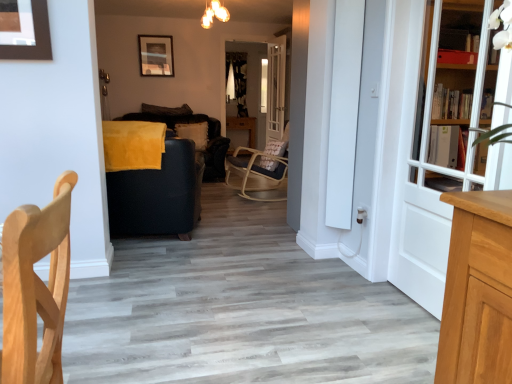
Where is `white glass door at center, the 1th door in the top-to-bottom sequence`? The width and height of the screenshot is (512, 384). white glass door at center, the 1th door in the top-to-bottom sequence is located at coordinates (275, 89).

In order to face white glass door at center, which is the 2th door from right to left, should I rotate leftwards or rightwards?

Rotate right and turn 2.544 degrees.

Where is `beige textured pillow at center, the second pillow viewed from the top`? This screenshot has width=512, height=384. beige textured pillow at center, the second pillow viewed from the top is located at coordinates (194, 133).

How much space does velvet black armchair at center, which is the 1th chair in back-to-front order, occupy horizontally?

velvet black armchair at center, which is the 1th chair in back-to-front order, is 39.11 inches in width.

This screenshot has width=512, height=384. What do you see at coordinates (214, 14) in the screenshot? I see `warm glass chandelier at upper center` at bounding box center [214, 14].

From the picture: In order to face white wooden bookcase at right, should I rotate leftwards or rightwards?

Rotate right and turn 32.406 degrees.

Where is `white glass door at center, the 1th door in the top-to-bottom sequence`? The image size is (512, 384). white glass door at center, the 1th door in the top-to-bottom sequence is located at coordinates (275, 89).

Which point is more forward, (x=152, y=112) or (x=146, y=72)?

The point (x=146, y=72) is closer.

Locate an element on the screen. the 1st pillow counting from the right side of the matte black picture frame at upper center is located at coordinates (166, 110).

How far apart are suede-like brown pillow at center, which is counted as the 2th pillow, starting from the bottom, and matte black picture frame at upper center?

26.83 inches.

Can you see suede-like brown pillow at center, which is counted as the 2th pillow, starting from the bottom, touching matte black picture frame at upper center?

No, suede-like brown pillow at center, which is counted as the 2th pillow, starting from the bottom, is not in contact with matte black picture frame at upper center.

Is warm glass chandelier at upper center not near white wooden bookcase at right?

Yes, warm glass chandelier at upper center and white wooden bookcase at right are quite far apart.

From the picture: In the image, is warm glass chandelier at upper center positioned in front of or behind white wooden bookcase at right?

Visually, warm glass chandelier at upper center is located behind white wooden bookcase at right.

Which is more to the right, warm glass chandelier at upper center or white wooden bookcase at right?

white wooden bookcase at right is more to the right.

Does white glass door at center, which ranks as the second door in bottom-to-top order, have a greater width compared to beige textured pillow at center, the second pillow viewed from the top?

In fact, white glass door at center, which ranks as the second door in bottom-to-top order, might be narrower than beige textured pillow at center, the second pillow viewed from the top.

Which of these two, white glass door at center, placed as the second door when sorted from front to back, or beige textured pillow at center, the first pillow ordered from the bottom, is bigger?

white glass door at center, placed as the second door when sorted from front to back.

What's the angular difference between white glass door at center, the 1th door in the top-to-bottom sequence, and beige textured pillow at center, the first pillow ordered from the bottom,'s facing directions?

The angle between the facing direction of white glass door at center, the 1th door in the top-to-bottom sequence, and the facing direction of beige textured pillow at center, the first pillow ordered from the bottom, is 84.9 degrees.

Is white glass door at center, placed as the second door when sorted from front to back, to the left of beige textured pillow at center, the second pillow viewed from the top, from the viewer's perspective?

Incorrect, white glass door at center, placed as the second door when sorted from front to back, is not on the left side of beige textured pillow at center, the second pillow viewed from the top.

Is suede-like brown pillow at center, which is counted as the 2th pillow, starting from the bottom, in front of beige textured pillow at center, the first pillow ordered from the bottom?

No.

From a real-world perspective, is suede-like brown pillow at center, which is counted as the 2th pillow, starting from the bottom, above or below beige textured pillow at center, the first pillow ordered from the bottom?

From a real-world perspective, suede-like brown pillow at center, which is counted as the 2th pillow, starting from the bottom, is physically above beige textured pillow at center, the first pillow ordered from the bottom.

You are a GUI agent. You are given a task and a screenshot of the screen. Output one action in this format:
    pyautogui.click(x=<x>, y=<y>)
    Task: Click on the pillow above the beige textured pillow at center, the first pillow ordered from the bottom (from the image's perspective)
    This screenshot has height=384, width=512.
    Given the screenshot: What is the action you would take?
    pyautogui.click(x=166, y=110)

Is natural wood chair at left, marked as the 2th chair in a back-to-front arrangement, thinner than white glass door at center, which is the 1th door in back-to-front order?

No, natural wood chair at left, marked as the 2th chair in a back-to-front arrangement, is not thinner than white glass door at center, which is the 1th door in back-to-front order.

Considering the relative positions of natural wood chair at left, the 1th chair viewed from the front, and white glass door at center, the 1th door in the top-to-bottom sequence, in the image provided, is natural wood chair at left, the 1th chair viewed from the front, to the right of white glass door at center, the 1th door in the top-to-bottom sequence, from the viewer's perspective?

In fact, natural wood chair at left, the 1th chair viewed from the front, is to the left of white glass door at center, the 1th door in the top-to-bottom sequence.

From the image's perspective, which is above, natural wood chair at left, the 1th chair viewed from the front, or white glass door at center, placed as the second door when sorted from front to back?

white glass door at center, placed as the second door when sorted from front to back.

Considering the relative sizes of white glass door at center, which is the 2th door from right to left, and warm glass chandelier at upper center in the image provided, is white glass door at center, which is the 2th door from right to left, shorter than warm glass chandelier at upper center?

Incorrect, the height of white glass door at center, which is the 2th door from right to left, does not fall short of that of warm glass chandelier at upper center.

Is white glass door at center, which is the 1th door in back-to-front order, far from warm glass chandelier at upper center?

Yes, white glass door at center, which is the 1th door in back-to-front order, and warm glass chandelier at upper center are located far from each other.

Considering the relative sizes of white glass door at center, which is the 2th door from right to left, and warm glass chandelier at upper center in the image provided, is white glass door at center, which is the 2th door from right to left, bigger than warm glass chandelier at upper center?

Yes, white glass door at center, which is the 2th door from right to left, is bigger than warm glass chandelier at upper center.

Can we say white glass door at center, the first door in the left-to-right sequence, lies outside warm glass chandelier at upper center?

Absolutely, white glass door at center, the first door in the left-to-right sequence, is external to warm glass chandelier at upper center.

Visually, is natural wood chair at left, marked as the 2th chair in a back-to-front arrangement, positioned to the left or to the right of suede-like brown pillow at center, which is counted as the 2th pillow, starting from the bottom?

In the image, natural wood chair at left, marked as the 2th chair in a back-to-front arrangement, appears on the right side of suede-like brown pillow at center, which is counted as the 2th pillow, starting from the bottom.

Considering the relative sizes of natural wood chair at left, marked as the 2th chair in a back-to-front arrangement, and suede-like brown pillow at center, the first pillow when ordered from top to bottom, in the image provided, is natural wood chair at left, marked as the 2th chair in a back-to-front arrangement, smaller than suede-like brown pillow at center, the first pillow when ordered from top to bottom,?

Incorrect, natural wood chair at left, marked as the 2th chair in a back-to-front arrangement, is not smaller in size than suede-like brown pillow at center, the first pillow when ordered from top to bottom.

This screenshot has width=512, height=384. I want to click on pillow that is the 2nd one when counting leftward from the natural wood chair at left, marked as the 2th chair in a back-to-front arrangement, so click(x=166, y=110).

The height and width of the screenshot is (384, 512). I want to click on the 1st pillow in front of the matte black picture frame at upper center, so click(166, 110).

Image resolution: width=512 pixels, height=384 pixels. Find the location of `bookcase lying on the right of warm glass chandelier at upper center`. bookcase lying on the right of warm glass chandelier at upper center is located at coordinates (456, 94).

Based on their spatial positions, is natural wood chair at left, marked as the 2th chair in a back-to-front arrangement, or matte black picture frame at upper center closer to suede-like brown pillow at center, the first pillow when ordered from top to bottom?

The object closer to suede-like brown pillow at center, the first pillow when ordered from top to bottom, is matte black picture frame at upper center.

Based on their spatial positions, is suede-like brown pillow at center, the first pillow when ordered from top to bottom, or white wooden door at right, which appears as the first door when viewed from the front, further from warm glass chandelier at upper center?

white wooden door at right, which appears as the first door when viewed from the front, is further to warm glass chandelier at upper center.

When comparing their distances from white wooden door at right, arranged as the 2th door when viewed from the left, does natural wood chair at left, marked as the 2th chair in a back-to-front arrangement, or warm glass chandelier at upper center seem further?

warm glass chandelier at upper center is positioned further to the anchor white wooden door at right, arranged as the 2th door when viewed from the left.

Which object lies nearer to the anchor point matte black picture frame at upper center, white wooden door at right, arranged as the 2th door when viewed from the left, or beige textured pillow at center, the first pillow ordered from the bottom?

beige textured pillow at center, the first pillow ordered from the bottom.

Considering their positions, is matte black picture frame at upper center positioned further to beige textured pillow at center, the first pillow ordered from the bottom, than white wooden door at right, the 2th door positioned from the back?

white wooden door at right, the 2th door positioned from the back, is further to beige textured pillow at center, the first pillow ordered from the bottom.

From the image, which object appears to be nearer to beige textured pillow at center, the second pillow viewed from the top, natural wood chair at left, marked as the 2th chair in a back-to-front arrangement, or white glass door at center, which is the 2th door from right to left?

Among the two, white glass door at center, which is the 2th door from right to left, is located nearer to beige textured pillow at center, the second pillow viewed from the top.

Looking at the image, which one is located further to white wooden bookcase at right, matte black picture frame at upper center or warm glass chandelier at upper center?

Based on the image, matte black picture frame at upper center appears to be further to white wooden bookcase at right.

Looking at the image, which one is located closer to matte black picture frame at upper center, white wooden door at right, the 2th door positioned from the back, or white glass door at center, which ranks as the second door in bottom-to-top order?

Based on the image, white glass door at center, which ranks as the second door in bottom-to-top order, appears to be nearer to matte black picture frame at upper center.

You are a GUI agent. You are given a task and a screenshot of the screen. Output one action in this format:
    pyautogui.click(x=<x>, y=<y>)
    Task: Click on the light fixture between natural wood chair at left, marked as the 2th chair in a back-to-front arrangement, and white glass door at center, which is the 2th door from right to left, along the z-axis
    
    Given the screenshot: What is the action you would take?
    pyautogui.click(x=214, y=14)

Identify the location of bookcase between natural wood chair at left, the 1th chair viewed from the front, and white wooden door at right, which is the 2th door in top-to-bottom order, in the horizontal direction. This screenshot has height=384, width=512. (456, 94).

Identify the location of bookcase positioned between natural wood chair at left, marked as the 2th chair in a back-to-front arrangement, and suede-like brown pillow at center, the first pillow when ordered from top to bottom, from near to far. This screenshot has width=512, height=384. (456, 94).

Where is `door between warm glass chandelier at upper center and matte black picture frame at upper center along the z-axis`? Image resolution: width=512 pixels, height=384 pixels. door between warm glass chandelier at upper center and matte black picture frame at upper center along the z-axis is located at coordinates (275, 89).